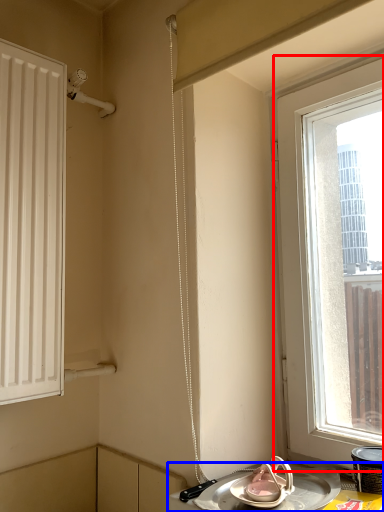
Question: Which of the following is the closest to the observer, window (highlighted by a red box) or table (highlighted by a blue box)?

Choices:
 (A) window
 (B) table

Answer: (B)